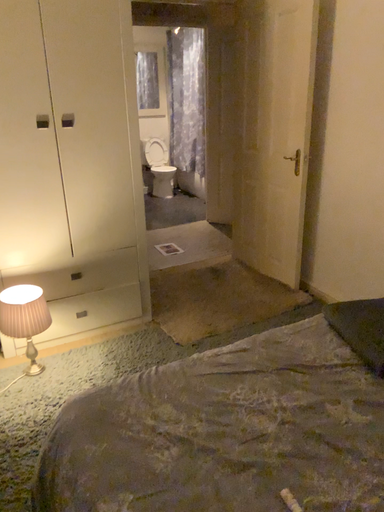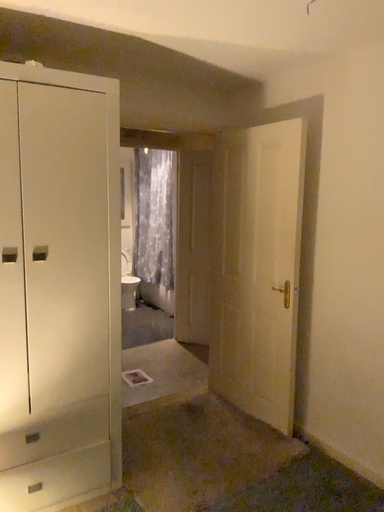
Question: Which way did the camera rotate in the video?

Choices:
 (A) rotated upward
 (B) rotated downward

Answer: (A)